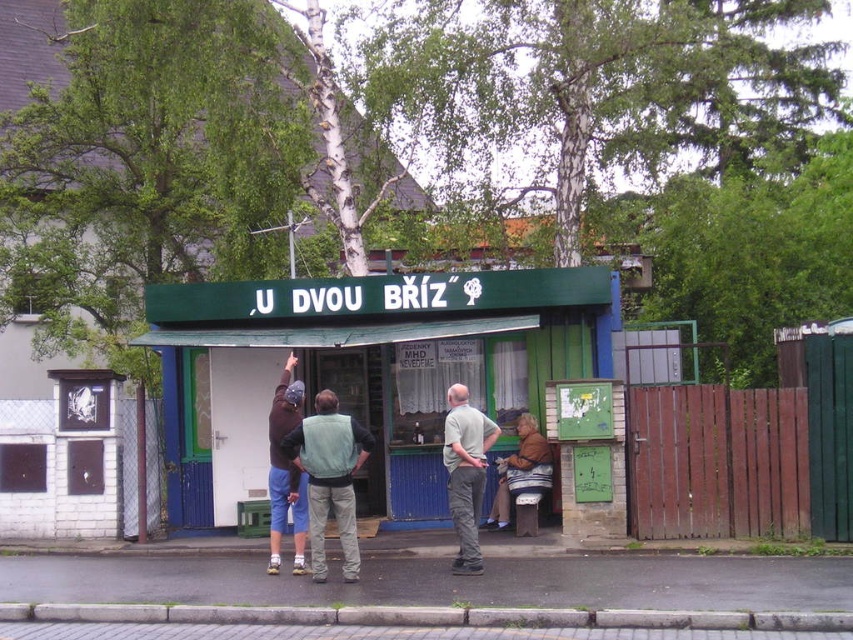
Question: Is light green vest at center to the left of striped fabric jacket at center from the viewer's perspective?

Choices:
 (A) no
 (B) yes

Answer: (B)

Question: Estimate the real-world distances between objects in this image. Which object is farther from the dark brown fabric jacket at center?

Choices:
 (A) striped fabric jacket at center
 (B) khaki pants at center

Answer: (A)

Question: Does green painted wood signboard at center have a greater width compared to dark brown fabric jacket at center?

Choices:
 (A) no
 (B) yes

Answer: (B)

Question: Which of the following is the closest to the observer?

Choices:
 (A) (514, 372)
 (B) (289, 458)
 (C) (479, 557)

Answer: (C)

Question: Is green painted wood signboard at center smaller than light green vest at center?

Choices:
 (A) no
 (B) yes

Answer: (A)

Question: Based on their relative distances, which object is nearer to the dark brown fabric jacket at center?

Choices:
 (A) striped fabric jacket at center
 (B) light green vest at center

Answer: (B)